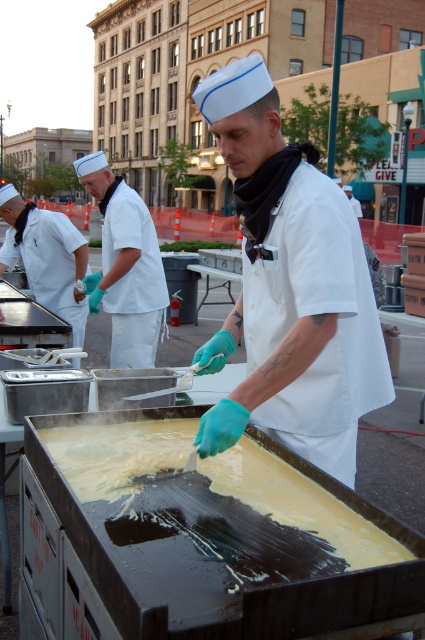
Question: Which object is the closest to the yellow matte batter at center?

Choices:
 (A) white matte chef hat at upper left
 (B) white matte sailor hat at upper left

Answer: (B)

Question: Can you confirm if white matte sailor hat at upper left is positioned to the left of white matte chef hat at upper left?

Choices:
 (A) no
 (B) yes

Answer: (A)

Question: Is yellow matte batter at center thinner than white matte chef hat at upper left?

Choices:
 (A) no
 (B) yes

Answer: (B)

Question: Which object appears closest to the camera in this image?

Choices:
 (A) yellow matte batter at center
 (B) white matte sailor hat at upper left

Answer: (A)

Question: Does yellow matte batter at center have a greater width compared to white matte chef hat at upper left?

Choices:
 (A) yes
 (B) no

Answer: (B)

Question: Which point is closer to the camera taking this photo?

Choices:
 (A) (142, 264)
 (B) (28, 209)

Answer: (A)